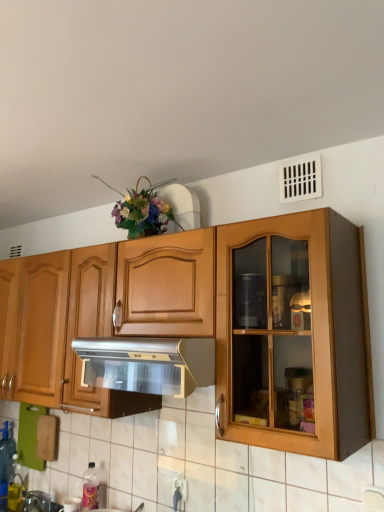
Image resolution: width=384 pixels, height=512 pixels. What do you see at coordinates (90, 488) in the screenshot? I see `pink plastic bottle at lower left, arranged as the 2th bottle when viewed from the back` at bounding box center [90, 488].

What is the approximate width of white plastic vent at upper right?

The width of white plastic vent at upper right is 1.05 inches.

The width and height of the screenshot is (384, 512). I want to click on translucent plastic bottle at lower left, acting as the first bottle starting from the left, so click(6, 455).

From the image's perspective, is white plastic vent at upper right above or below silver metallic range hood at center?

white plastic vent at upper right is situated higher than silver metallic range hood at center in the image.

Is silver metallic range hood at center inside white plastic vent at upper right?

No, white plastic vent at upper right does not contain silver metallic range hood at center.

Considering the positions of objects white plastic vent at upper right and silver metallic range hood at center in the image provided, who is more to the left, white plastic vent at upper right or silver metallic range hood at center?

silver metallic range hood at center.

Can you confirm if white plastic vent at upper right is positioned to the right of pink plastic bottle at lower left, placed as the 1th bottle when sorted from right to left?

Yes, white plastic vent at upper right is to the right of pink plastic bottle at lower left, placed as the 1th bottle when sorted from right to left.

Is white plastic vent at upper right completely or partially outside of pink plastic bottle at lower left, placed as the 1th bottle when sorted from right to left?

Absolutely, white plastic vent at upper right is external to pink plastic bottle at lower left, placed as the 1th bottle when sorted from right to left.

From the image's perspective, which one is positioned lower, white plastic vent at upper right or pink plastic bottle at lower left, the 1th bottle viewed from the front?

pink plastic bottle at lower left, the 1th bottle viewed from the front, appears lower in the image.

Can you confirm if white plastic vent at upper right is smaller than pink plastic bottle at lower left, placed as the 1th bottle when sorted from right to left?

Correct, white plastic vent at upper right occupies less space than pink plastic bottle at lower left, placed as the 1th bottle when sorted from right to left.

Is the position of pink plastic bottle at lower left, which ranks as the second bottle in left-to-right order, less distant than that of translucent plastic bottle at lower left, placed as the 2th bottle when sorted from right to left?

Yes.

This screenshot has height=512, width=384. I want to click on bottle below the translucent plastic bottle at lower left, placed as the 2th bottle when sorted from right to left (from a real-world perspective), so [x=90, y=488].

Is pink plastic bottle at lower left, arranged as the 2th bottle when viewed from the back, spatially inside translucent plastic bottle at lower left, the second bottle when ordered from front to back, or outside of it?

pink plastic bottle at lower left, arranged as the 2th bottle when viewed from the back, is not inside translucent plastic bottle at lower left, the second bottle when ordered from front to back, it's outside.

Considering the relative sizes of pink plastic bottle at lower left, the 1th bottle viewed from the front, and translucent plastic bottle at lower left, placed as the 2th bottle when sorted from right to left, in the image provided, is pink plastic bottle at lower left, the 1th bottle viewed from the front, bigger than translucent plastic bottle at lower left, placed as the 2th bottle when sorted from right to left,?

Actually, pink plastic bottle at lower left, the 1th bottle viewed from the front, might be smaller than translucent plastic bottle at lower left, placed as the 2th bottle when sorted from right to left.

Looking at this image, considering the relative sizes of translucent plastic bottle at lower left, the second bottle when ordered from front to back, and silver metallic range hood at center in the image provided, is translucent plastic bottle at lower left, the second bottle when ordered from front to back, wider than silver metallic range hood at center?

In fact, translucent plastic bottle at lower left, the second bottle when ordered from front to back, might be narrower than silver metallic range hood at center.

From the image's perspective, is translucent plastic bottle at lower left, placed as the 2th bottle when sorted from right to left, below silver metallic range hood at center?

Yes, from the image's perspective, translucent plastic bottle at lower left, placed as the 2th bottle when sorted from right to left, is beneath silver metallic range hood at center.

What's the angular difference between white plastic vent at upper right and translucent plastic bottle at lower left, acting as the first bottle starting from the left,'s facing directions?

The angular difference between white plastic vent at upper right and translucent plastic bottle at lower left, acting as the first bottle starting from the left, is 2.06 degrees.

Does white plastic vent at upper right turn towards translucent plastic bottle at lower left, acting as the first bottle starting from the left?

No, white plastic vent at upper right is not aimed at translucent plastic bottle at lower left, acting as the first bottle starting from the left.

From the picture: From the image's perspective, is white plastic vent at upper right positioned above or below translucent plastic bottle at lower left, the second bottle when ordered from front to back?

Based on their image positions, white plastic vent at upper right is located above translucent plastic bottle at lower left, the second bottle when ordered from front to back.

Which object is further away from the camera, white plastic vent at upper right or translucent plastic bottle at lower left, acting as the first bottle starting from the left?

Positioned behind is translucent plastic bottle at lower left, acting as the first bottle starting from the left.

Is pink plastic bottle at lower left, placed as the 1th bottle when sorted from right to left, a part of translucent plastic bottle at lower left, acting as the first bottle starting from the left?

No, pink plastic bottle at lower left, placed as the 1th bottle when sorted from right to left, is not surrounded by translucent plastic bottle at lower left, acting as the first bottle starting from the left.

Is pink plastic bottle at lower left, arranged as the 2th bottle when viewed from the back, at the back of translucent plastic bottle at lower left, the second bottle when ordered from front to back?

No, translucent plastic bottle at lower left, the second bottle when ordered from front to back,'s orientation is not away from pink plastic bottle at lower left, arranged as the 2th bottle when viewed from the back.

From the image's perspective, which is above, translucent plastic bottle at lower left, the second bottle when ordered from front to back, or pink plastic bottle at lower left, arranged as the 2th bottle when viewed from the back?

pink plastic bottle at lower left, arranged as the 2th bottle when viewed from the back, is shown above in the image.

Is the surface of translucent plastic bottle at lower left, placed as the 2th bottle when sorted from right to left, in direct contact with pink plastic bottle at lower left, the 1th bottle viewed from the front?

translucent plastic bottle at lower left, placed as the 2th bottle when sorted from right to left, and pink plastic bottle at lower left, the 1th bottle viewed from the front, are clearly separated.

Measure the distance from pink plastic bottle at lower left, the 1th bottle viewed from the front, to silver metallic range hood at center.

32.91 inches.

Considering the sizes of pink plastic bottle at lower left, placed as the 1th bottle when sorted from right to left, and silver metallic range hood at center in the image, is pink plastic bottle at lower left, placed as the 1th bottle when sorted from right to left, taller or shorter than silver metallic range hood at center?

Considering their sizes, pink plastic bottle at lower left, placed as the 1th bottle when sorted from right to left, has more height than silver metallic range hood at center.

Considering the points (94, 476) and (169, 342), which point is behind, point (94, 476) or point (169, 342)?

The point (94, 476) is more distant.

Could you tell me if pink plastic bottle at lower left, placed as the 1th bottle when sorted from right to left, is turned towards silver metallic range hood at center?

No.

In order to click on kitchen appliance below the white plastic vent at upper right (from a real-world perspective) in this screenshot , I will do 147,364.

The image size is (384, 512). There is a pink plastic bottle at lower left, which ranks as the second bottle in left-to-right order. Identify the location of window above it (from a real-world perspective). (301, 178).

From the image, which object appears to be farther from translucent plastic bottle at lower left, placed as the 2th bottle when sorted from right to left, silver metallic range hood at center or white plastic vent at upper right?

Based on the image, white plastic vent at upper right appears to be further to translucent plastic bottle at lower left, placed as the 2th bottle when sorted from right to left.

Considering their positions, is translucent plastic bottle at lower left, acting as the first bottle starting from the left, positioned closer to pink plastic bottle at lower left, which ranks as the second bottle in left-to-right order, than white plastic vent at upper right?

translucent plastic bottle at lower left, acting as the first bottle starting from the left, lies closer to pink plastic bottle at lower left, which ranks as the second bottle in left-to-right order, than the other object.

When comparing their distances from translucent plastic bottle at lower left, acting as the first bottle starting from the left, does pink plastic bottle at lower left, the 1th bottle viewed from the front, or silver metallic range hood at center seem further?

Among the two, silver metallic range hood at center is located further to translucent plastic bottle at lower left, acting as the first bottle starting from the left.

Based on their spatial positions, is white plastic vent at upper right or pink plastic bottle at lower left, which ranks as the second bottle in left-to-right order, further from translucent plastic bottle at lower left, placed as the 2th bottle when sorted from right to left?

Based on the image, white plastic vent at upper right appears to be further to translucent plastic bottle at lower left, placed as the 2th bottle when sorted from right to left.

Estimate the real-world distances between objects in this image. Which object is further from white plastic vent at upper right, pink plastic bottle at lower left, arranged as the 2th bottle when viewed from the back, or silver metallic range hood at center?

Result: The object further to white plastic vent at upper right is pink plastic bottle at lower left, arranged as the 2th bottle when viewed from the back.

Considering their positions, is silver metallic range hood at center positioned further to pink plastic bottle at lower left, placed as the 1th bottle when sorted from right to left, than white plastic vent at upper right?

The object further to pink plastic bottle at lower left, placed as the 1th bottle when sorted from right to left, is white plastic vent at upper right.

Based on their spatial positions, is translucent plastic bottle at lower left, placed as the 2th bottle when sorted from right to left, or silver metallic range hood at center closer to pink plastic bottle at lower left, the 1th bottle viewed from the front?

Among the two, translucent plastic bottle at lower left, placed as the 2th bottle when sorted from right to left, is located nearer to pink plastic bottle at lower left, the 1th bottle viewed from the front.

Estimate the real-world distances between objects in this image. Which object is further from white plastic vent at upper right, pink plastic bottle at lower left, arranged as the 2th bottle when viewed from the back, or translucent plastic bottle at lower left, placed as the 2th bottle when sorted from right to left?

Based on the image, translucent plastic bottle at lower left, placed as the 2th bottle when sorted from right to left, appears to be further to white plastic vent at upper right.

Where is `bottle between white plastic vent at upper right and translucent plastic bottle at lower left, acting as the first bottle starting from the left, in the up-down direction`? This screenshot has height=512, width=384. bottle between white plastic vent at upper right and translucent plastic bottle at lower left, acting as the first bottle starting from the left, in the up-down direction is located at coordinates (90, 488).

The width and height of the screenshot is (384, 512). What are the coordinates of `kitchen appliance between white plastic vent at upper right and pink plastic bottle at lower left, placed as the 1th bottle when sorted from right to left, in the vertical direction` in the screenshot? It's located at (147, 364).

At what (x,y) coordinates should I click in order to perform the action: click on bottle between silver metallic range hood at center and translucent plastic bottle at lower left, the second bottle when ordered from front to back, along the z-axis. Please return your answer as a coordinate pair (x, y). This screenshot has width=384, height=512. Looking at the image, I should click on (90, 488).

Locate an element on the screen. This screenshot has height=512, width=384. kitchen appliance situated between translucent plastic bottle at lower left, the second bottle when ordered from front to back, and white plastic vent at upper right from left to right is located at coordinates (147, 364).